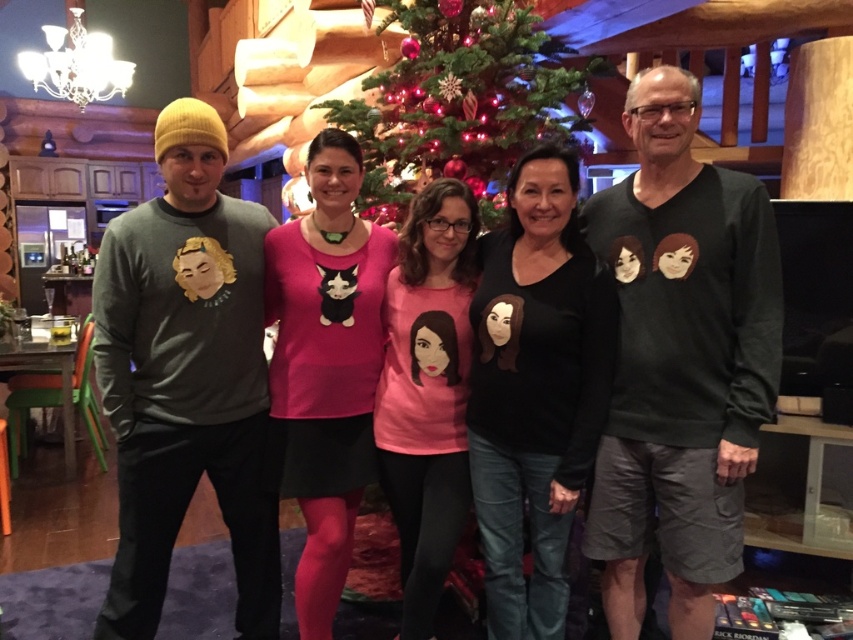
Question: Does dark gray sweater at left appear on the right side of pink matte sweater at center?

Choices:
 (A) no
 (B) yes

Answer: (B)

Question: Among these points, which one is farthest from the camera?

Choices:
 (A) (465, 356)
 (B) (397, 61)

Answer: (B)

Question: Which point is closer to the camera?

Choices:
 (A) (347, 333)
 (B) (589, 65)
 (C) (711, 275)

Answer: (C)

Question: Can you confirm if pink matte sweater at center is thinner than green matte christmas tree at center?

Choices:
 (A) yes
 (B) no

Answer: (A)

Question: Among these points, which one is nearest to the camera?

Choices:
 (A) (308, 419)
 (B) (451, 448)

Answer: (B)

Question: Can you confirm if dark gray sweater at left is positioned above pink matte sweater at center?

Choices:
 (A) yes
 (B) no

Answer: (A)